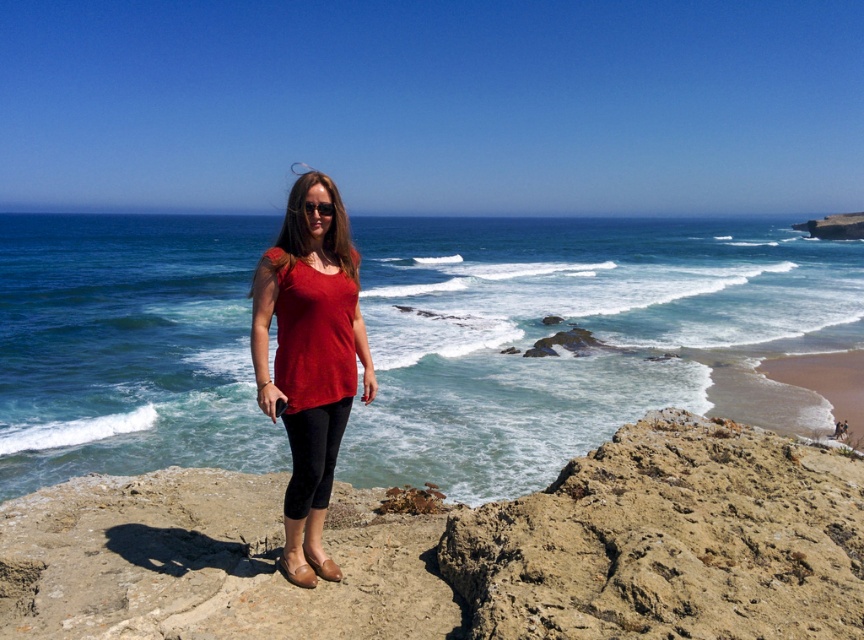
Is blue water at center above matte red blouse at center?

Yes, blue water at center is above matte red blouse at center.

Which is behind, point (108, 456) or point (296, 358)?

Positioned behind is point (108, 456).

This screenshot has height=640, width=864. Identify the location of blue water at center. (583, 326).

Based on the photo, can you confirm if blue water at center is positioned above rough stone cliff at center?

Yes.

Does blue water at center have a greater width compared to rough stone cliff at center?

Correct, the width of blue water at center exceeds that of rough stone cliff at center.

Which is behind, point (118, 243) or point (715, 522)?

The point (118, 243) is more distant.

The image size is (864, 640). I want to click on blue water at center, so 583,326.

Is rough stone cliff at center positioned behind matte red blouse at center?

No, it is in front of matte red blouse at center.

Describe the element at coordinates (462, 550) in the screenshot. The image size is (864, 640). I see `rough stone cliff at center` at that location.

This screenshot has height=640, width=864. I want to click on rough stone cliff at center, so click(462, 550).